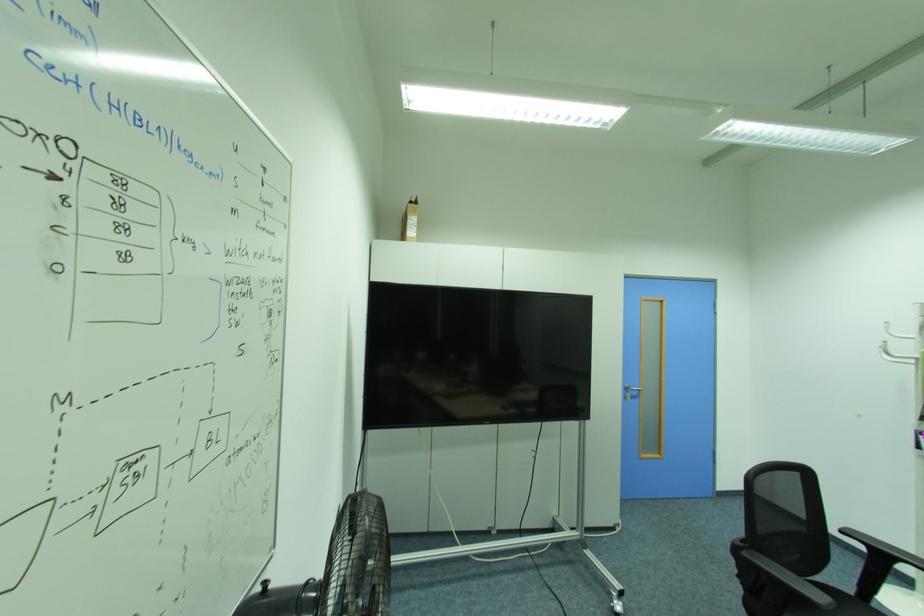
The height and width of the screenshot is (616, 924). Identify the location of silver door handle. (630, 392).